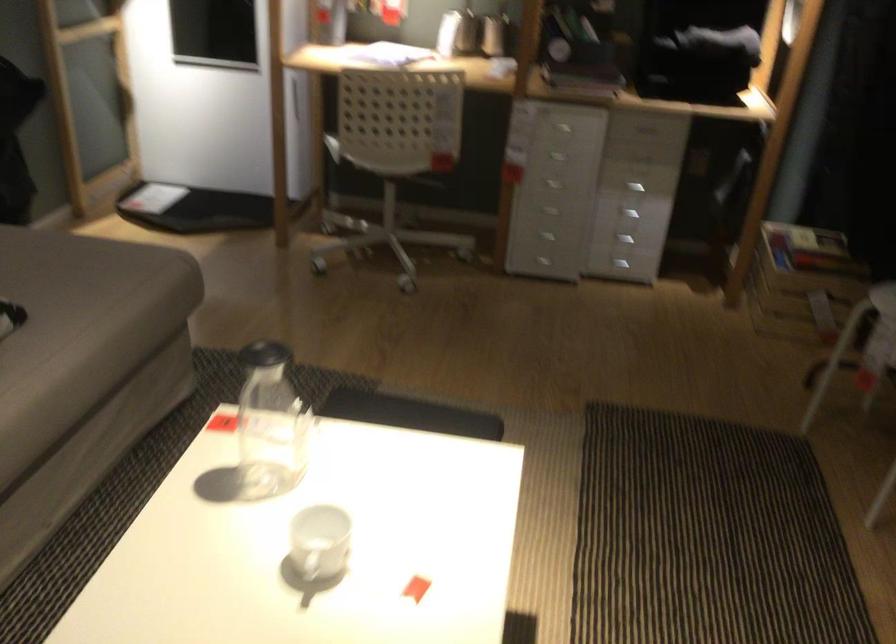
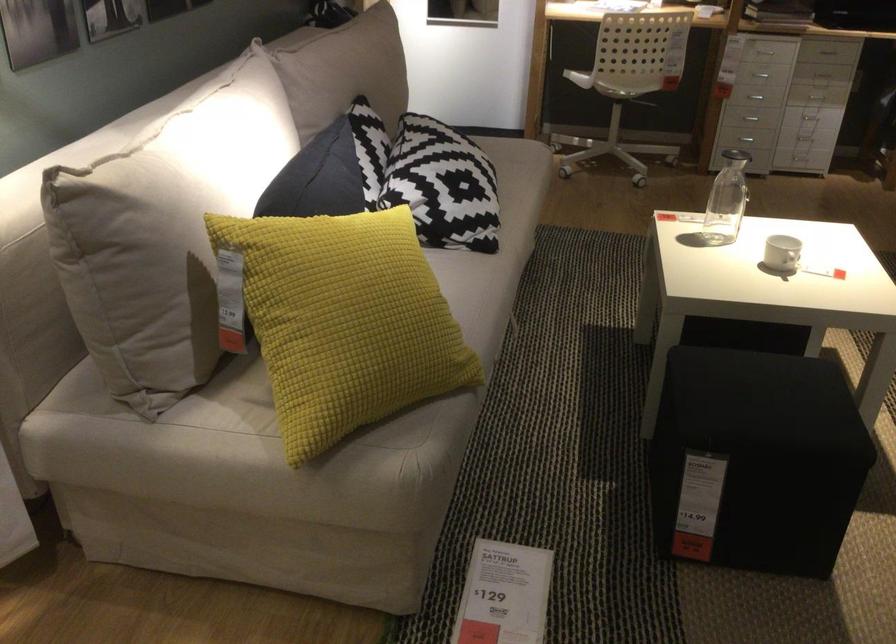
Question: I am providing you with two images of the same scene from different viewpoints. Please identify which objects are invisible in image2.

Choices:
 (A) patterned pillow
 (B) drawer handle
 (C) sofa sitting surface
 (D) none of these

Answer: (D)